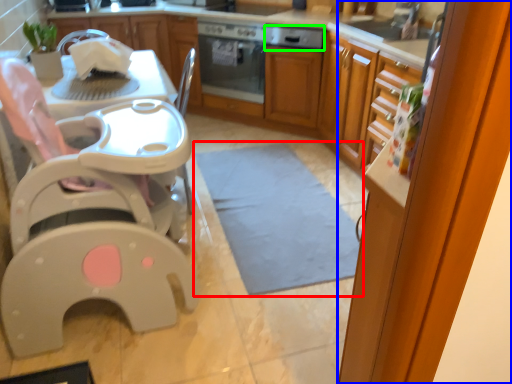
Question: Which object is the farthest from mat (highlighted by a red box)? Choose among these: screen door (highlighted by a blue box) or kitchen appliance (highlighted by a green box).

Choices:
 (A) screen door
 (B) kitchen appliance

Answer: (B)